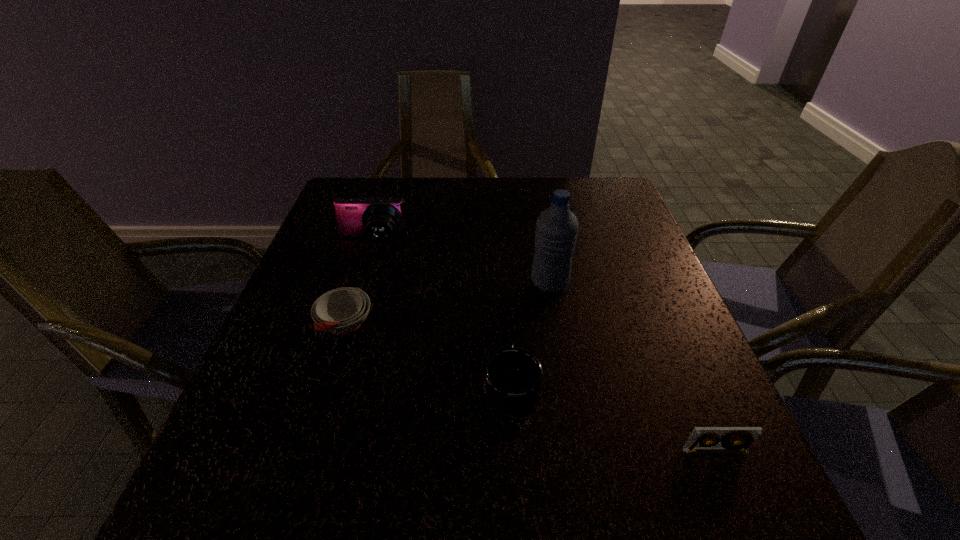
Identify the location of vacant region at the near edge of the desktop. (571, 498).

This screenshot has width=960, height=540. I want to click on free location at the left edge, so click(366, 258).

At what (x,y) coordinates should I click in order to perform the action: click on free space at the right edge. Please return your answer as a coordinate pair (x, y). Image resolution: width=960 pixels, height=540 pixels. Looking at the image, I should click on (681, 312).

In the image, there is a desktop. Where is `vacant space at the far left corner`? This screenshot has width=960, height=540. vacant space at the far left corner is located at coordinates (328, 208).

Where is `free location at the far right corner of the desktop`? free location at the far right corner of the desktop is located at coordinates (602, 202).

Find the location of a particular element. This screenshot has width=960, height=540. vacant space that is in between the camera and the third object from right to left is located at coordinates (442, 314).

Find the location of a particular element. The width and height of the screenshot is (960, 540). free space between the nearest object and the tallest object is located at coordinates (633, 367).

You are a GUI agent. You are given a task and a screenshot of the screen. Output one action in this format:
    pyautogui.click(x=<x>, y=<y>)
    Task: Click on the free space between the second tallest object and the mug
    The image size is (960, 540).
    Given the screenshot: What is the action you would take?
    pyautogui.click(x=442, y=314)

Locate an element on the screen. free space between the third nearest object and the farthest object is located at coordinates (359, 284).

At what (x,y) coordinates should I click in order to perform the action: click on free space between the rightmost object and the camera. Please return your answer as a coordinate pair (x, y). Looking at the image, I should click on (543, 347).